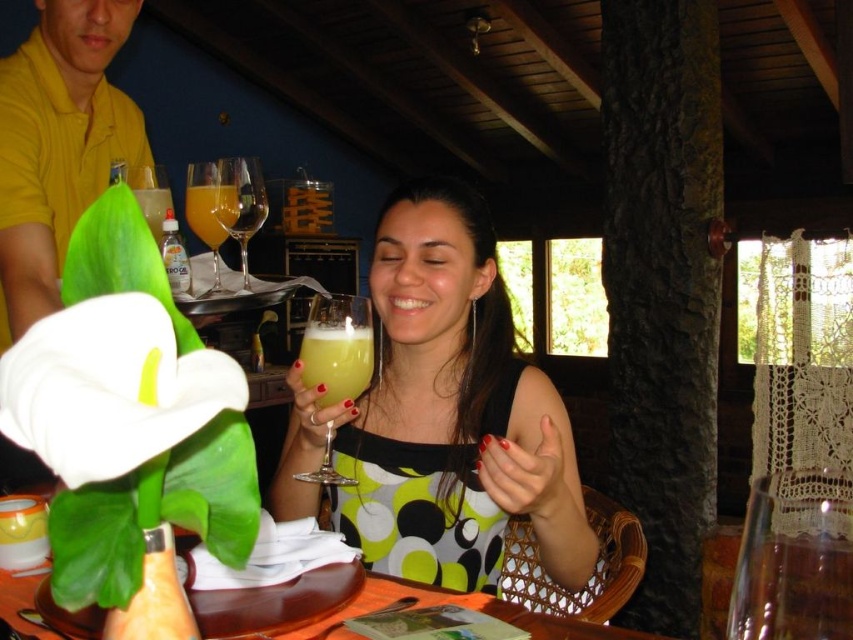
Which is behind, point (479, 456) or point (151, 228)?

The point (151, 228) is behind.

Who is positioned more to the right, green dotted dress at center or translucent glass at upper left?

green dotted dress at center

Describe the element at coordinates (442, 413) in the screenshot. I see `green dotted dress at center` at that location.

The height and width of the screenshot is (640, 853). Find the location of `green dotted dress at center`. green dotted dress at center is located at coordinates (442, 413).

Does translucent glass wine glass at upper center have a lesser height compared to translucent glass at upper left?

In fact, translucent glass wine glass at upper center may be taller than translucent glass at upper left.

Which is in front, point (201, 186) or point (149, 186)?

Point (201, 186)

Locate an element on the screen. The width and height of the screenshot is (853, 640). translucent glass wine glass at upper center is located at coordinates (212, 209).

Is translucent glass at upper center taller than translucent glass at upper left?

In fact, translucent glass at upper center may be shorter than translucent glass at upper left.

Which is behind, point (198, 221) or point (158, 204)?

Point (158, 204)

Where is `translucent glass at upper center`? translucent glass at upper center is located at coordinates (210, 211).

The image size is (853, 640). What are the coordinates of `translucent glass at upper center` in the screenshot? It's located at (210, 211).